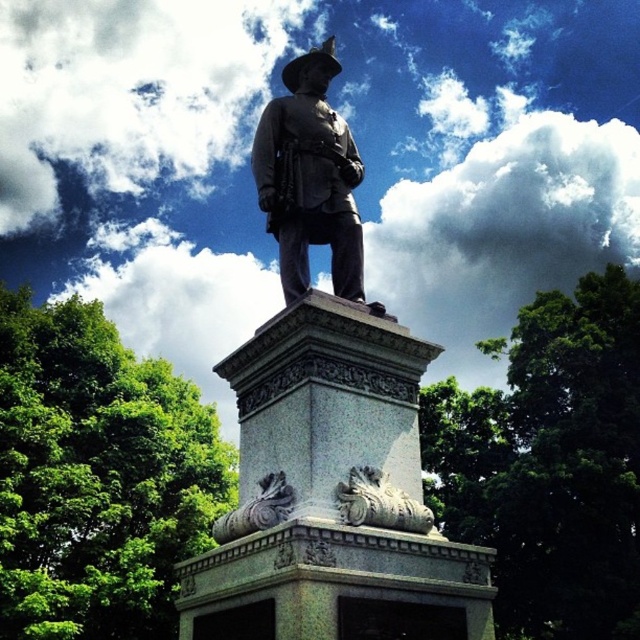
You are standing at the origin point of a coordinate system where the image is displayed. The statue is at coordinate point 0.661, 0.511. If you want to walk directly towards the gray stone statue at center, in which direction should you move?

Since the gray stone statue at center is located at coordinate point (x=326, y=422), you should move towards the right and slightly forward to reach it.

You are an art conservator assessing the placement of the statues in the image. Which statue is located higher up between the gray stone statue at center and the polished bronze statue at center?

The polished bronze statue at center is higher up because the gray stone statue at center is positioned under it.

Based on the photo, you are an art conservator assessing the statue and its pedestal. You need to determine which object is taller between the gray stone statue at center and the carved stone ornament at center. Based on the scene, which one is taller?

The gray stone statue at center is taller than the carved stone ornament at center.